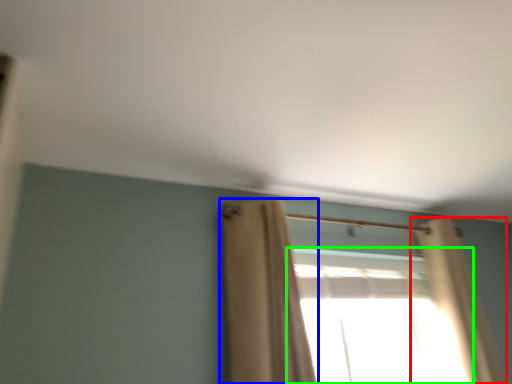
Question: Considering the real-world distances, which object is farthest from curtain (highlighted by a red box)? curtain (highlighted by a blue box) or window (highlighted by a green box)?

Choices:
 (A) curtain
 (B) window

Answer: (A)